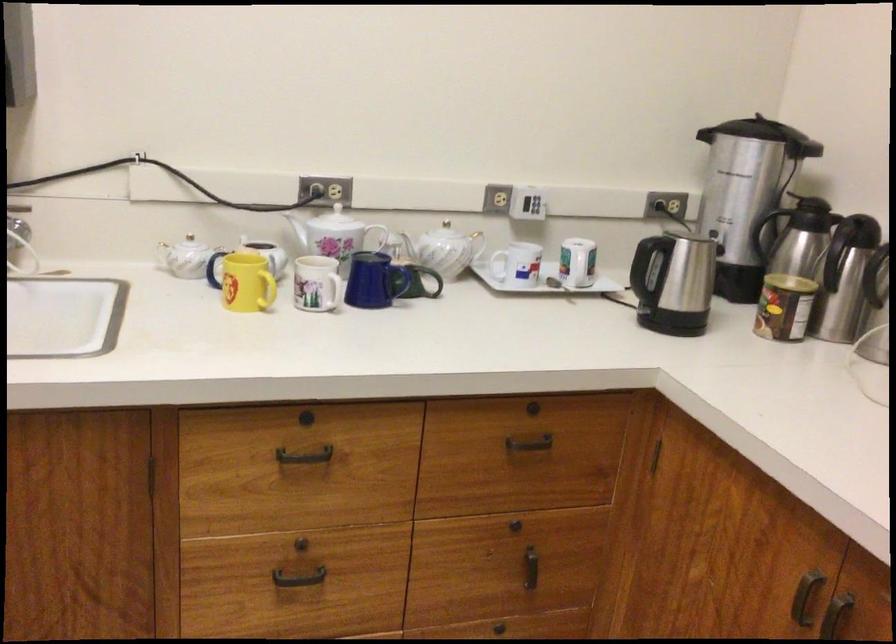
The height and width of the screenshot is (644, 896). I want to click on urn side handle, so 811,204.